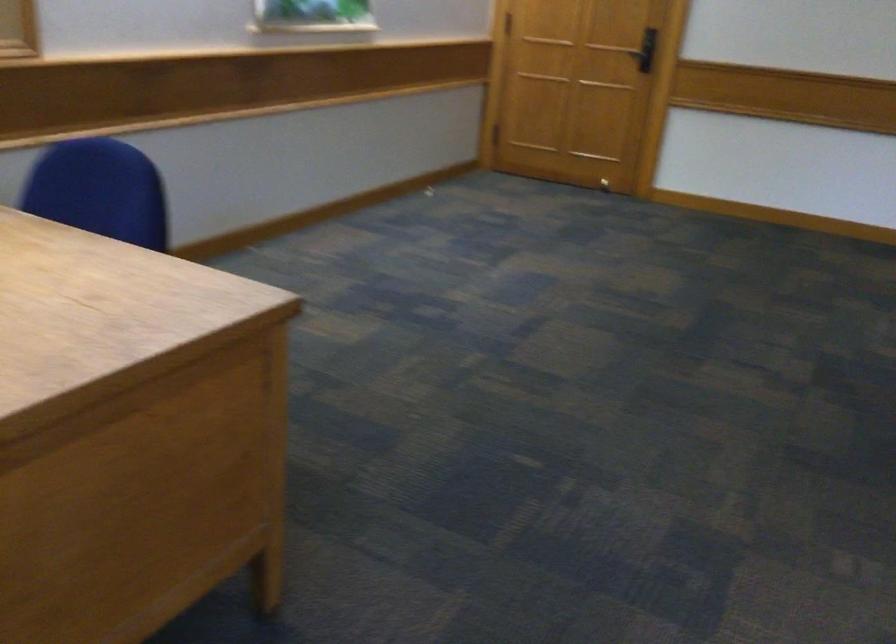
Question: The camera is either moving clockwise (left) or counter-clockwise (right) around the object. The first image is from the beginning of the video and the second image is from the end. Is the camera moving left or right when shooting the video?

Choices:
 (A) Left
 (B) Right

Answer: (A)